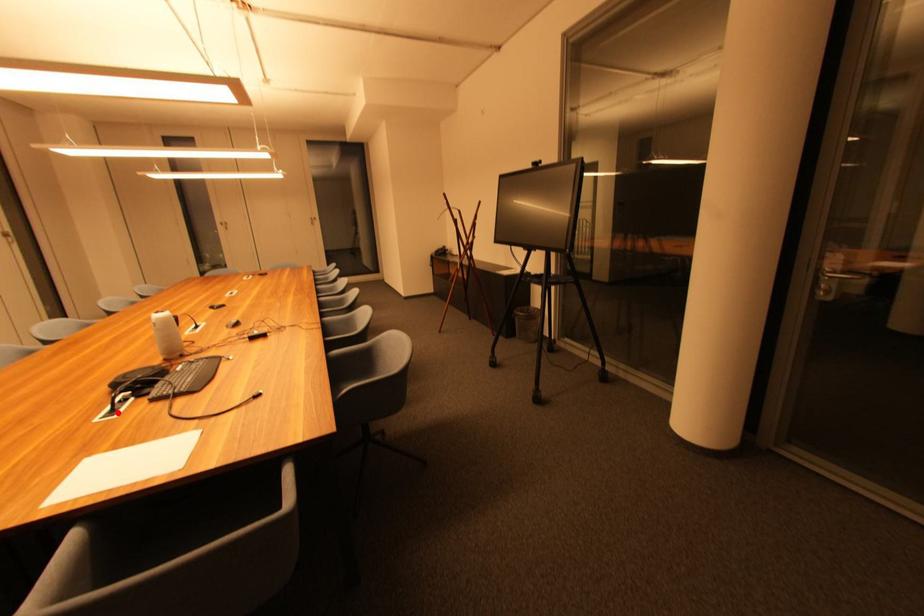
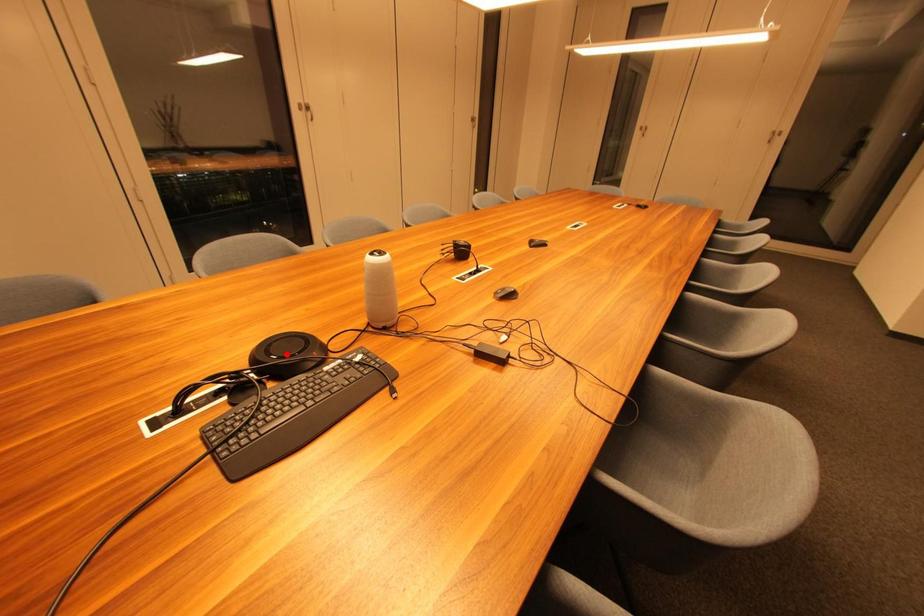
I am providing you with two images of the same scene from different viewpoints. A red point is marked on the first image and another point is marked on the second image. Do the highlighted points in image1 and image2 indicate the same real-world spot?

No